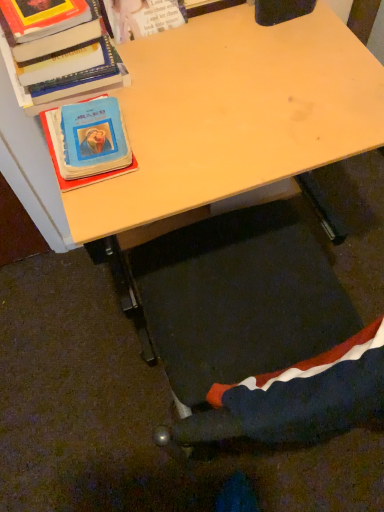
You are a GUI agent. You are given a task and a screenshot of the screen. Output one action in this format:
    pyautogui.click(x=<x>, y=<y>)
    Task: Click on the free spot to the right of blue matte book at left, arranged as the 2th book when viewed from the top
    Image resolution: width=384 pixels, height=512 pixels.
    Given the screenshot: What is the action you would take?
    pyautogui.click(x=189, y=133)